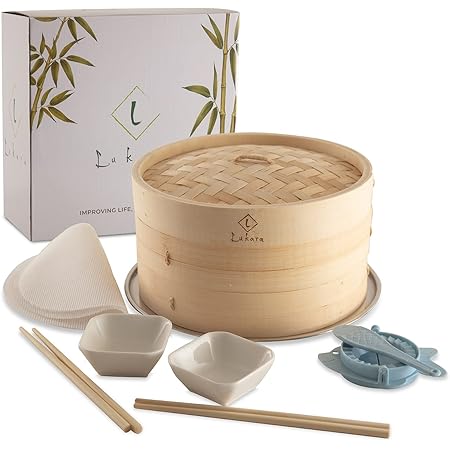
Where is `bamboo steamer basket`? bamboo steamer basket is located at coordinates (283, 248).